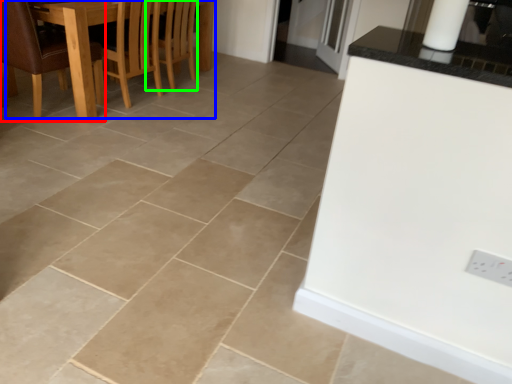
Question: Which object is the farthest from chair (highlighted by a red box)? Choose among these: kitchen & dining room table (highlighted by a blue box) or armchair (highlighted by a green box).

Choices:
 (A) kitchen & dining room table
 (B) armchair

Answer: (B)